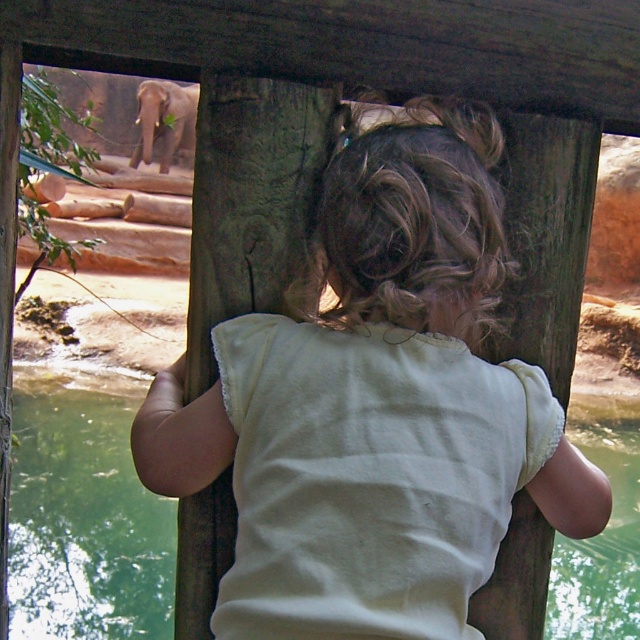
Who is more forward, (445, 433) or (148, 93)?

Point (445, 433) is more forward.

Is point (180, 468) less distant than point (141, 122)?

Yes, point (180, 468) is in front of point (141, 122).

Does point (416, 244) come behind point (157, 93)?

No, it is not.

Where is `light yellow fabric at center`? The width and height of the screenshot is (640, 640). light yellow fabric at center is located at coordinates (381, 337).

Consider the image. Is light yellow fabric at center positioned before green liquid water at lower center?

Yes, it is.

Between point (227, 416) and point (563, 586), which one is positioned behind?

The point (563, 586) is more distant.

Find the location of a particular element. The image size is (640, 640). light yellow fabric at center is located at coordinates (381, 337).

Between green liquid water at lower center and gray textured elephant at upper left, which one appears on the left side from the viewer's perspective?

From the viewer's perspective, gray textured elephant at upper left appears more on the left side.

Is green liquid water at lower center to the right of gray textured elephant at upper left from the viewer's perspective?

Correct, you'll find green liquid water at lower center to the right of gray textured elephant at upper left.

Which is behind, point (141, 532) or point (179, 140)?

The point (179, 140) is more distant.

Find the location of `green liquid water at lower center`. green liquid water at lower center is located at coordinates (83, 524).